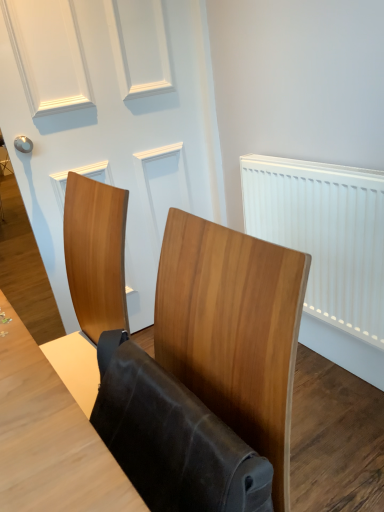
Question: Does leather-like brown folding chair at center have a lesser height compared to white plastic radiator at right?

Choices:
 (A) no
 (B) yes

Answer: (B)

Question: Can you confirm if leather-like brown folding chair at center is positioned to the left of white plastic radiator at right?

Choices:
 (A) yes
 (B) no

Answer: (A)

Question: Does leather-like brown folding chair at center have a greater height compared to white plastic radiator at right?

Choices:
 (A) yes
 (B) no

Answer: (B)

Question: Is leather-like brown folding chair at center smaller than white plastic radiator at right?

Choices:
 (A) yes
 (B) no

Answer: (A)

Question: From a real-world perspective, is leather-like brown folding chair at center located higher than white plastic radiator at right?

Choices:
 (A) no
 (B) yes

Answer: (B)

Question: Is leather-like brown folding chair at center facing towards white plastic radiator at right?

Choices:
 (A) no
 (B) yes

Answer: (A)

Question: Does white plastic radiator at right have a lesser width compared to white matte door at upper center?

Choices:
 (A) no
 (B) yes

Answer: (B)

Question: From a real-world perspective, is white plastic radiator at right on top of white matte door at upper center?

Choices:
 (A) no
 (B) yes

Answer: (A)

Question: From the image's perspective, is white plastic radiator at right below white matte door at upper center?

Choices:
 (A) no
 (B) yes

Answer: (B)

Question: Considering the relative sizes of white plastic radiator at right and white matte door at upper center in the image provided, is white plastic radiator at right wider than white matte door at upper center?

Choices:
 (A) yes
 (B) no

Answer: (B)

Question: Considering the relative sizes of white plastic radiator at right and white matte door at upper center in the image provided, is white plastic radiator at right smaller than white matte door at upper center?

Choices:
 (A) no
 (B) yes

Answer: (B)

Question: Considering the relative sizes of white plastic radiator at right and white matte door at upper center in the image provided, is white plastic radiator at right bigger than white matte door at upper center?

Choices:
 (A) no
 (B) yes

Answer: (A)

Question: Is white matte door at upper center beside leather-like brown folding chair at center?

Choices:
 (A) yes
 (B) no

Answer: (B)